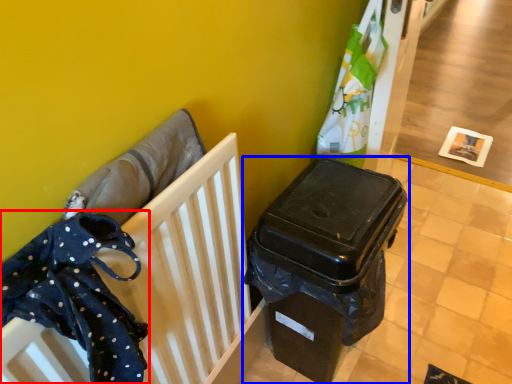
Question: Among these objects, which one is nearest to the camera, clothe (highlighted by a red box) or waste container (highlighted by a blue box)?

Choices:
 (A) clothe
 (B) waste container

Answer: (A)